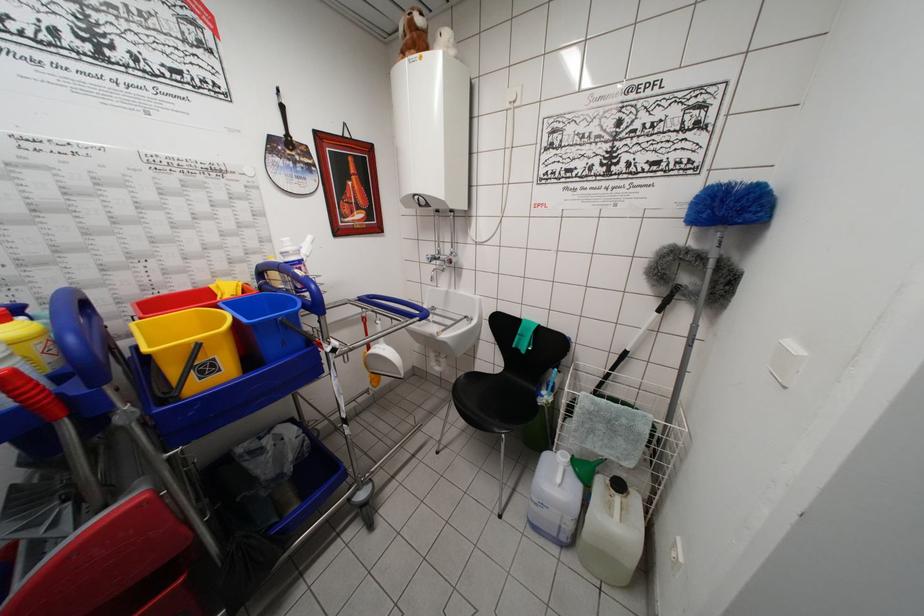
Where would you lift the green funnel? Please return your answer as a coordinate pair (x, y).

(585, 469)